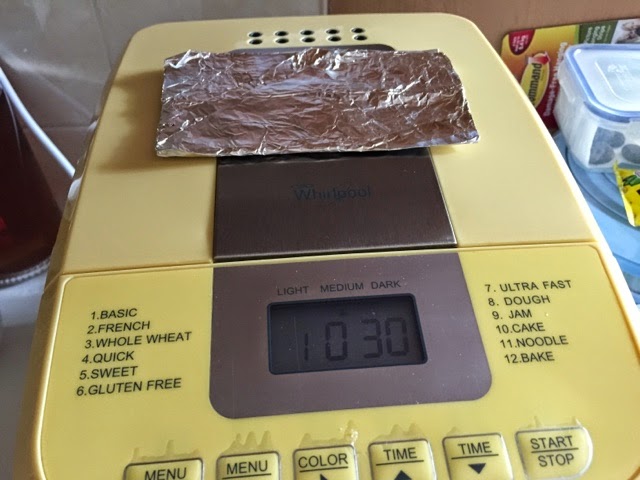
At what (x,y) coordinates should I click in order to perform the action: click on backdrop. Please return your answer as a coordinate pair (x, y). The image size is (640, 480). Looking at the image, I should click on (136, 15).